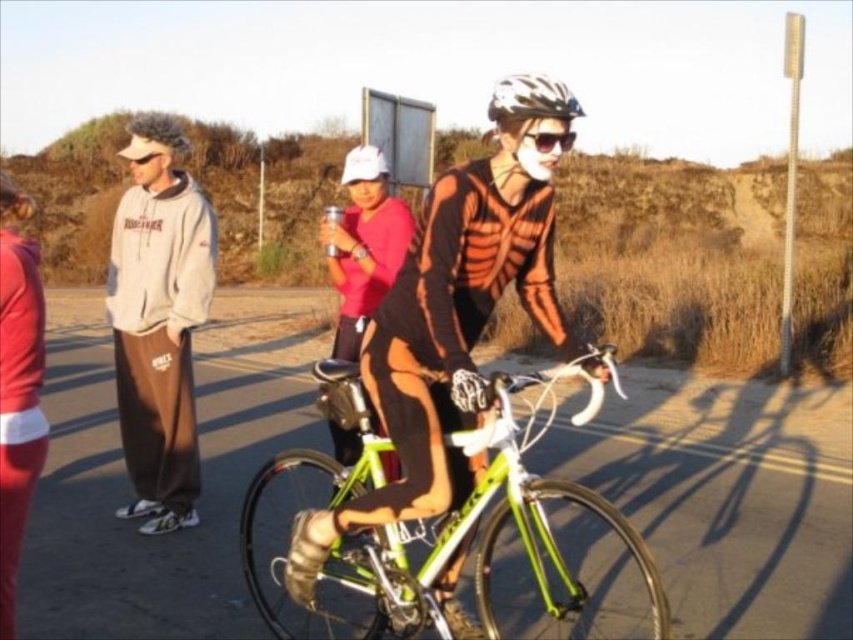
You are a delivery person who needs to carry a large package from the matte pink hoodie at lower left to the green metallic bicycle at center. Considering their widths, will the package fit between them without needing to move either object?

The green metallic bicycle at center is wider than the matte pink hoodie at lower left. Since the package needs to fit between them, the narrower width of the matte pink hoodie at lower left determines the available space. If the package is narrower than the hoodie, it should fit, but if it exceeds the hoodie, it won

You are a delivery person who needs to place both the green metallic bicycle at center and the matte red shirt at center into a storage locker. The locker has a depth of 35 inches. Can both items be placed inside without overlapping?

The green metallic bicycle at center is 35.39 inches away from matte red shirt at center. Since the distance between them is greater than the locker depth of 35 inches, they cannot be placed inside without overlapping.